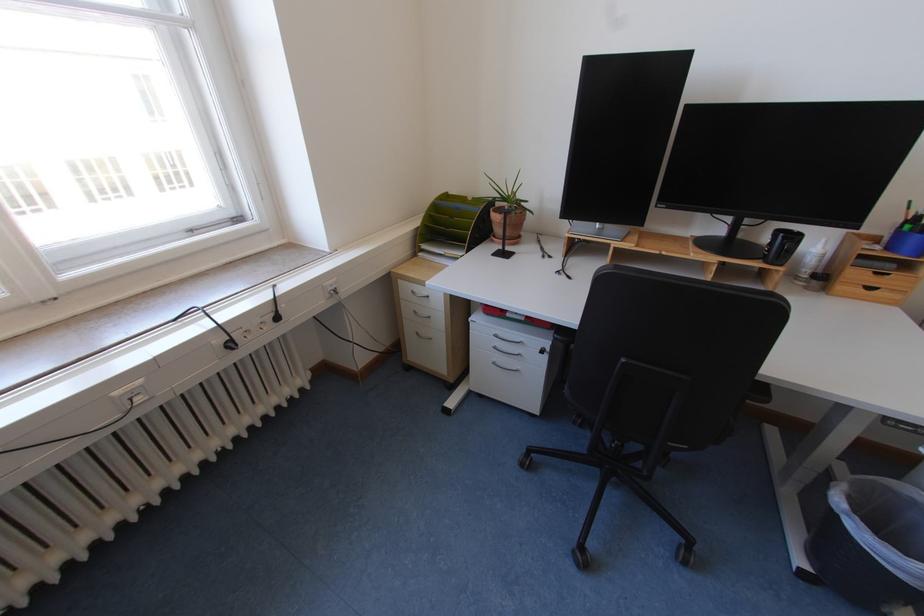
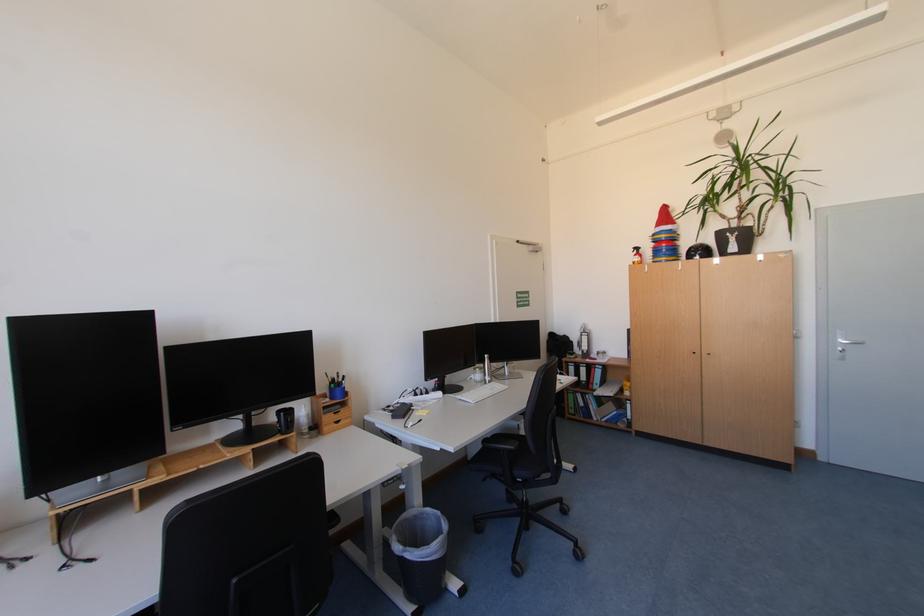
Locate, in the second image, the point that corresponds to point (822, 283) in the first image.

(321, 432)